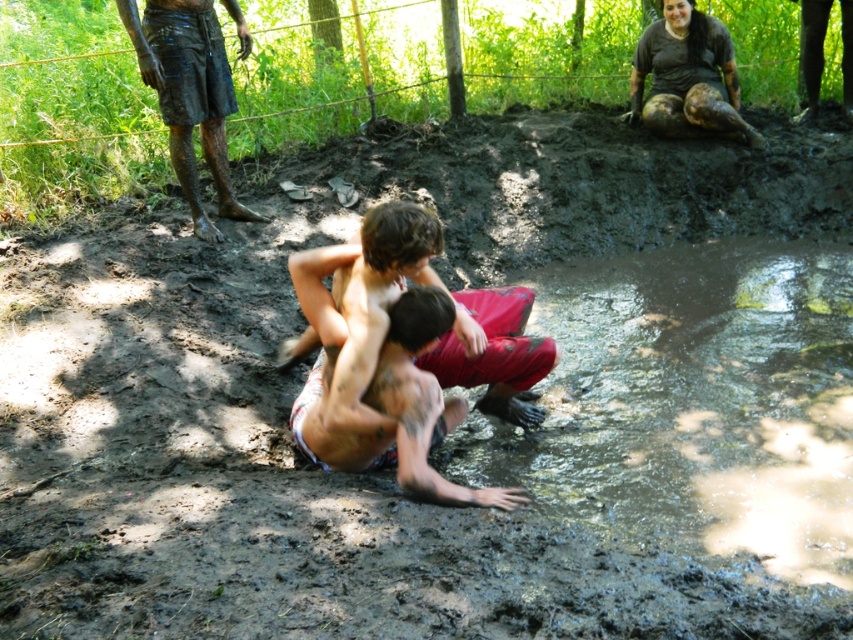
Question: Can you confirm if shiny skin child at center is positioned to the right of muddy skin at upper center?

Choices:
 (A) yes
 (B) no

Answer: (B)

Question: Which of the following is the farthest from the observer?

Choices:
 (A) shiny skin child at center
 (B) muddy shorts at upper left
 (C) muddy skin at upper center

Answer: (C)

Question: Is muddy shorts at upper left above muddy skin at upper center?

Choices:
 (A) yes
 (B) no

Answer: (B)

Question: Which object is the closest to the shiny skin child at center?

Choices:
 (A) shiny skin squat at center
 (B) muddy shorts at upper left
 (C) muddy skin at upper center

Answer: (A)

Question: Is shiny skin squat at center further to the viewer compared to muddy shorts at upper left?

Choices:
 (A) yes
 (B) no

Answer: (B)

Question: Which object is the farthest from the shiny skin child at center?

Choices:
 (A) shiny skin squat at center
 (B) muddy shorts at upper left

Answer: (B)